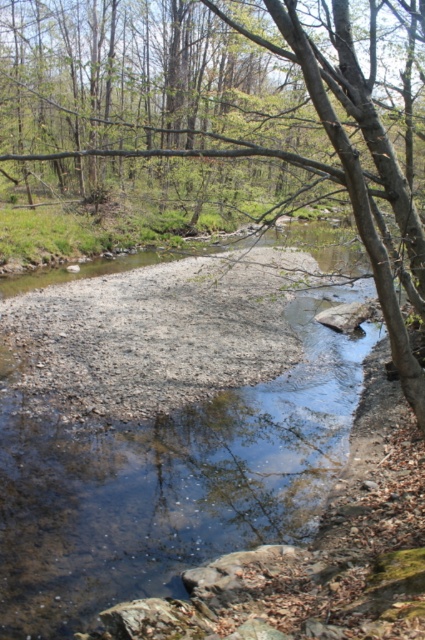
Question: Can you confirm if brown bark tree at center is smaller than clear water at center?

Choices:
 (A) yes
 (B) no

Answer: (B)

Question: Can you confirm if brown bark tree at center is positioned above clear water at center?

Choices:
 (A) no
 (B) yes

Answer: (B)

Question: Which point is closer to the camera?

Choices:
 (A) (124, 502)
 (B) (5, 99)

Answer: (A)

Question: Can you confirm if brown bark tree at center is smaller than clear water at center?

Choices:
 (A) no
 (B) yes

Answer: (A)